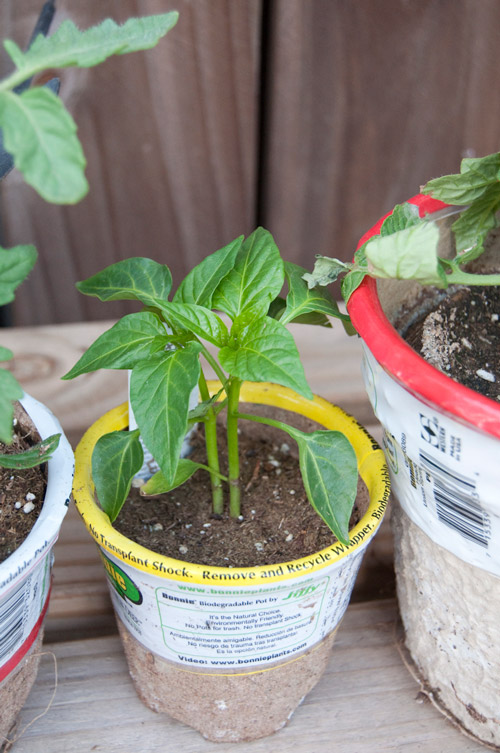
At what (x,y) coordinates should I click in order to perform the action: click on rightmost planter. Please return your answer as a coordinate pair (x, y). This screenshot has height=753, width=500. Looking at the image, I should click on (459, 589).